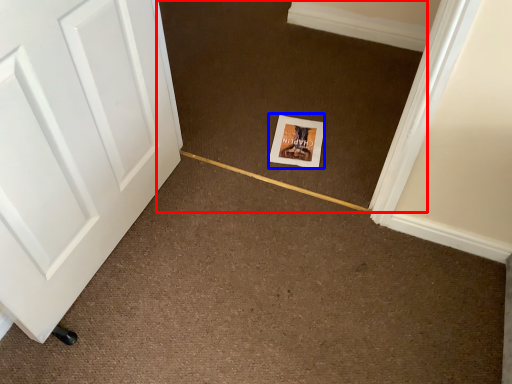
Question: Which point is further to the camera, plain (highlighted by a red box) or postcard (highlighted by a blue box)?

Choices:
 (A) plain
 (B) postcard

Answer: (B)